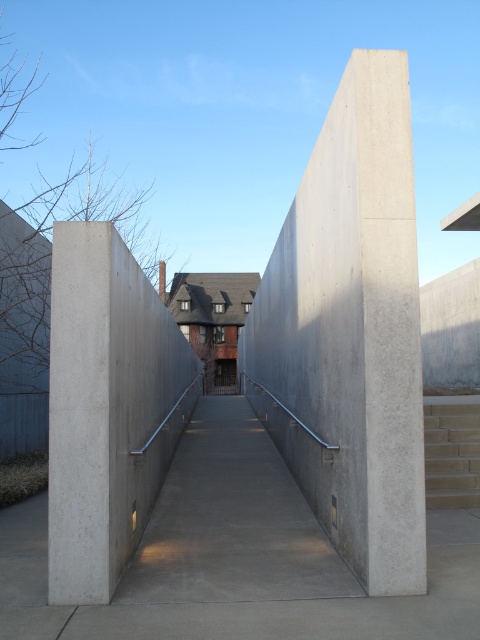
Can you confirm if smooth concrete wall at center is smaller than smooth concrete pillar at center?

No, smooth concrete wall at center is not smaller than smooth concrete pillar at center.

Is the position of smooth concrete wall at center less distant than that of smooth concrete pillar at center?

That is False.

Is point (328, 436) less distant than point (57, 252)?

No, (328, 436) is behind (57, 252).

The height and width of the screenshot is (640, 480). I want to click on smooth concrete wall at center, so click(x=350, y=332).

Between smooth concrete wall at center and smooth concrete ramp at center, which one has less height?

smooth concrete ramp at center is shorter.

Can you confirm if smooth concrete wall at center is thinner than smooth concrete ramp at center?

Correct, smooth concrete wall at center's width is less than smooth concrete ramp at center's.

Locate an element on the screen. This screenshot has width=480, height=640. smooth concrete wall at center is located at coordinates (350, 332).

Looking at this image, is smooth concrete pillar at center bigger than smooth concrete ramp at center?

Correct, smooth concrete pillar at center is larger in size than smooth concrete ramp at center.

Which is more to the right, smooth concrete pillar at center or smooth concrete ramp at center?

From the viewer's perspective, smooth concrete ramp at center appears more on the right side.

What do you see at coordinates (107, 408) in the screenshot? The width and height of the screenshot is (480, 640). I see `smooth concrete pillar at center` at bounding box center [107, 408].

This screenshot has width=480, height=640. Identify the location of smooth concrete pillar at center. (107, 408).